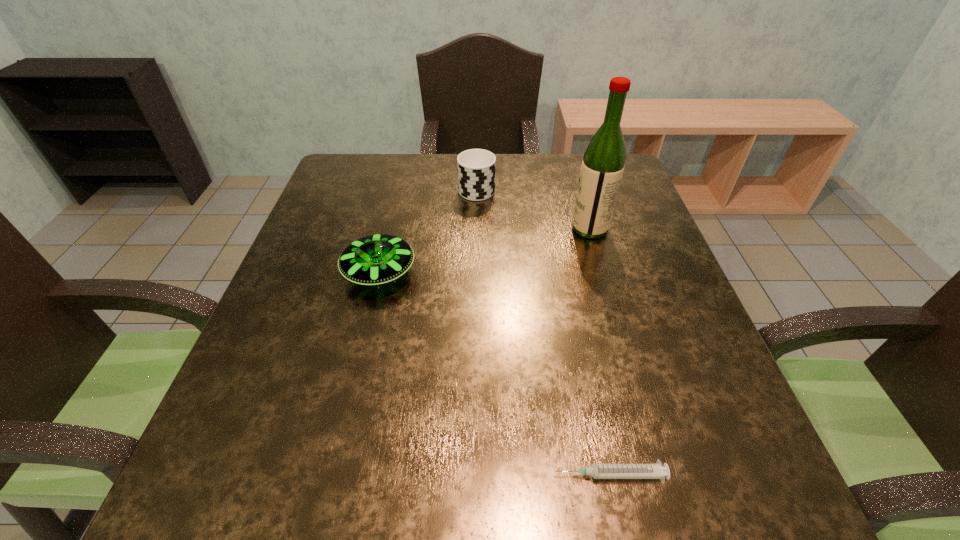
Where is `vacant space in between the cup and the nearest object`? The width and height of the screenshot is (960, 540). vacant space in between the cup and the nearest object is located at coordinates (543, 331).

Locate an element on the screen. This screenshot has height=540, width=960. free spot between the nearest object and the leftmost object is located at coordinates (494, 374).

This screenshot has height=540, width=960. Find the location of `free area in between the third nearest object and the nearest object`. free area in between the third nearest object and the nearest object is located at coordinates (600, 352).

Identify the location of vacant area that lies between the cup and the nearest object. (543, 331).

What are the coordinates of `empty location between the liquor and the second shortest object` in the screenshot? It's located at (485, 251).

Find the location of a particular element. The height and width of the screenshot is (540, 960). free space between the syringe and the third tallest object is located at coordinates click(x=494, y=374).

Find the location of a particular element. Image resolution: width=960 pixels, height=540 pixels. free area in between the leftmost object and the cup is located at coordinates (428, 230).

Locate an element on the screen. vacant area between the tallest object and the second tallest object is located at coordinates (533, 208).

What are the coordinates of `free spot between the liquor and the shortest object` in the screenshot? It's located at (600, 352).

Identify which object is located as the third nearest to the second object from left to right. Please provide its 2D coordinates. Your answer should be formatted as a tuple, i.e. [(x, y)], where the tuple contains the x and y coordinates of a point satisfying the conditions above.

[(598, 471)]